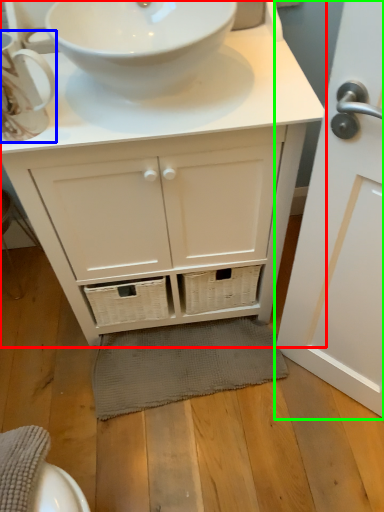
Question: Estimate the real-world distances between objects in this image. Which object is farther from bathroom cabinet (highlighted by a red box), teacup (highlighted by a blue box) or door (highlighted by a green box)?

Choices:
 (A) teacup
 (B) door

Answer: (A)